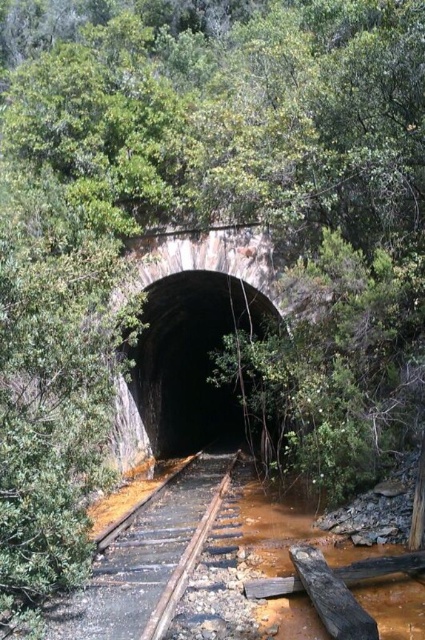
Question: Is black concrete tunnel at center positioned before brown wooden train track at center?

Choices:
 (A) yes
 (B) no

Answer: (B)

Question: Which of the following is the closest to the observer?

Choices:
 (A) black concrete tunnel at center
 (B) brown wooden train track at center

Answer: (B)

Question: Is black concrete tunnel at center in front of brown wooden train track at center?

Choices:
 (A) yes
 (B) no

Answer: (B)

Question: Does black concrete tunnel at center have a lesser width compared to brown wooden train track at center?

Choices:
 (A) yes
 (B) no

Answer: (B)